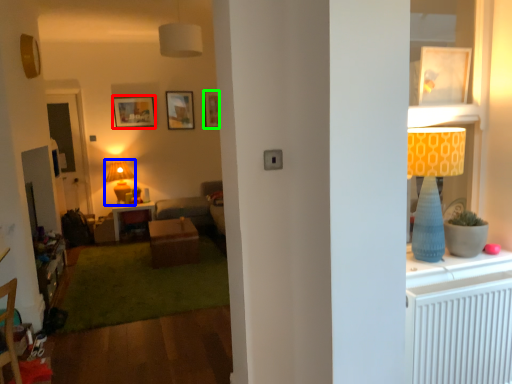
Question: Which object is the farthest from picture frame (highlighted by a red box)? Choose among these: lamp (highlighted by a blue box) or picture frame (highlighted by a green box).

Choices:
 (A) lamp
 (B) picture frame

Answer: (B)